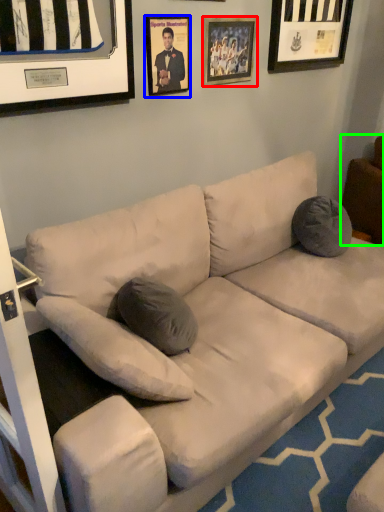
Question: Which object is the farthest from picture frame (highlighted by a red box)? Choose among these: picture frame (highlighted by a blue box) or furniture (highlighted by a green box).

Choices:
 (A) picture frame
 (B) furniture

Answer: (B)